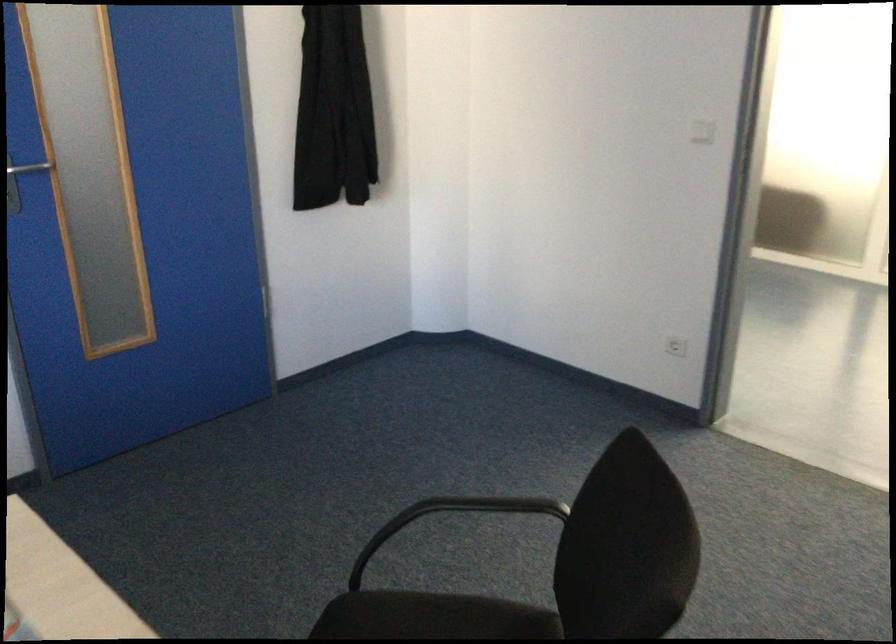
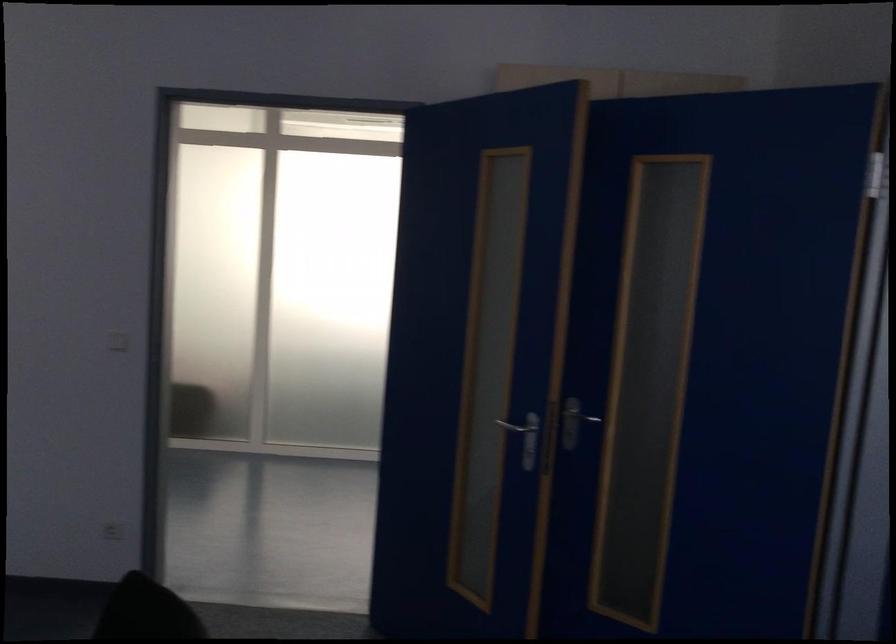
Find the pixel in the second image that matches point 702,126 in the first image.

(117, 341)